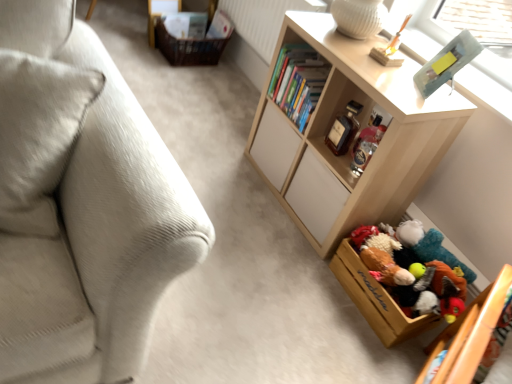
Question: Is light wood shelf at center shorter than brown woven basket at upper left, the second storage box from the right?

Choices:
 (A) no
 (B) yes

Answer: (A)

Question: Is light wood shelf at center outside brown woven basket at upper left, the 1th storage box when ordered from top to bottom?

Choices:
 (A) no
 (B) yes

Answer: (B)

Question: Is light wood shelf at center turned away from brown woven basket at upper left, the second storage box from the right?

Choices:
 (A) yes
 (B) no

Answer: (B)

Question: From a real-world perspective, is light wood shelf at center positioned under brown woven basket at upper left, the 1th storage box when ordered from top to bottom, based on gravity?

Choices:
 (A) no
 (B) yes

Answer: (A)

Question: Could you tell me if light wood shelf at center is facing brown woven basket at upper left, the 1th storage box from the back?

Choices:
 (A) yes
 (B) no

Answer: (B)

Question: Is light wood shelf at center not close to brown woven basket at upper left, acting as the second storage box starting from the bottom?

Choices:
 (A) yes
 (B) no

Answer: (A)

Question: Is the surface of white textured radiator at upper center in direct contact with light beige fabric couch at left?

Choices:
 (A) no
 (B) yes

Answer: (A)

Question: From the image's perspective, is white textured radiator at upper center under light beige fabric couch at left?

Choices:
 (A) yes
 (B) no

Answer: (B)

Question: Does white textured radiator at upper center have a lesser width compared to light beige fabric couch at left?

Choices:
 (A) yes
 (B) no

Answer: (A)

Question: Considering the relative sizes of white textured radiator at upper center and light beige fabric couch at left in the image provided, is white textured radiator at upper center taller than light beige fabric couch at left?

Choices:
 (A) no
 (B) yes

Answer: (A)

Question: Is white textured radiator at upper center oriented towards light beige fabric couch at left?

Choices:
 (A) no
 (B) yes

Answer: (A)

Question: Can you confirm if white textured radiator at upper center is smaller than light beige fabric couch at left?

Choices:
 (A) no
 (B) yes

Answer: (B)

Question: Considering the relative sizes of brown woven basket at upper left, the 1th storage box from the back, and light wood shelf at center in the image provided, is brown woven basket at upper left, the 1th storage box from the back, smaller than light wood shelf at center?

Choices:
 (A) no
 (B) yes

Answer: (B)